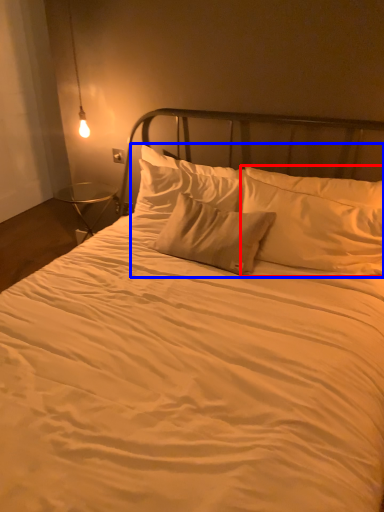
Question: Which object appears closest to the camera in this image, pillow (highlighted by a red box) or pillow (highlighted by a blue box)?

Choices:
 (A) pillow
 (B) pillow

Answer: (B)